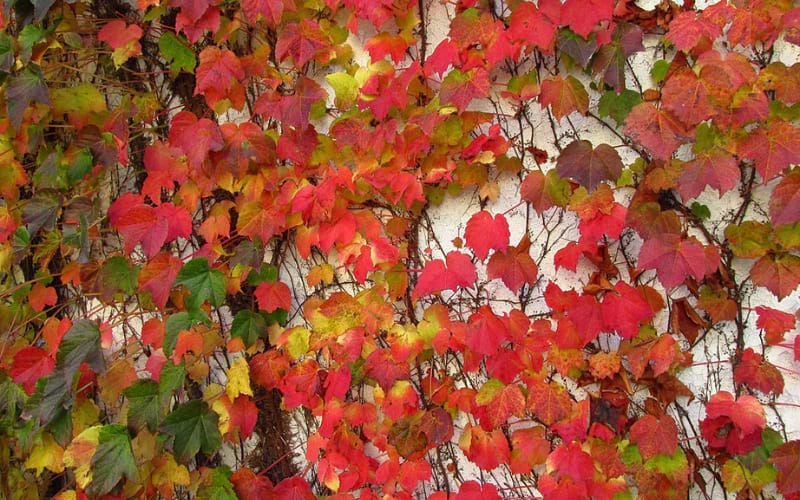
You are a GUI agent. You are given a task and a screenshot of the screen. Output one action in this format:
    pyautogui.click(x=<x>, y=<y>)
    Task: Click on the wall
    The height and width of the screenshot is (500, 800).
    Given the screenshot: What is the action you would take?
    pyautogui.click(x=450, y=213)